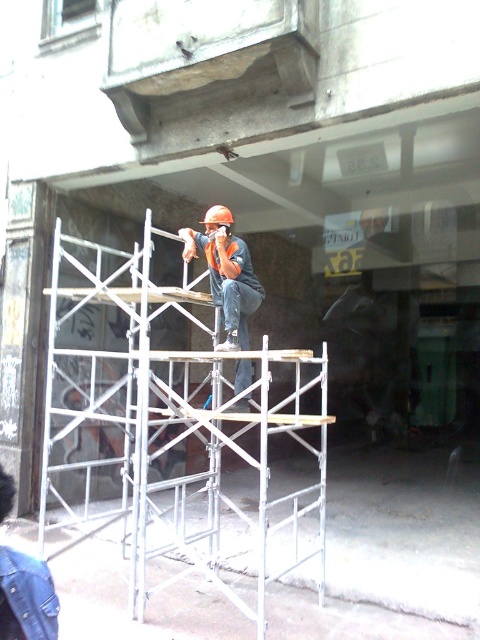
You are a safety inspector standing at the camera position. You need to check the distance between the silver metallic scaffolding at center and your current position. Is the distance within the required 4 meters safety zone?

The silver metallic scaffolding at center and camera are 3.71 meters apart, so the distance is within the required 4 meters safety zone.